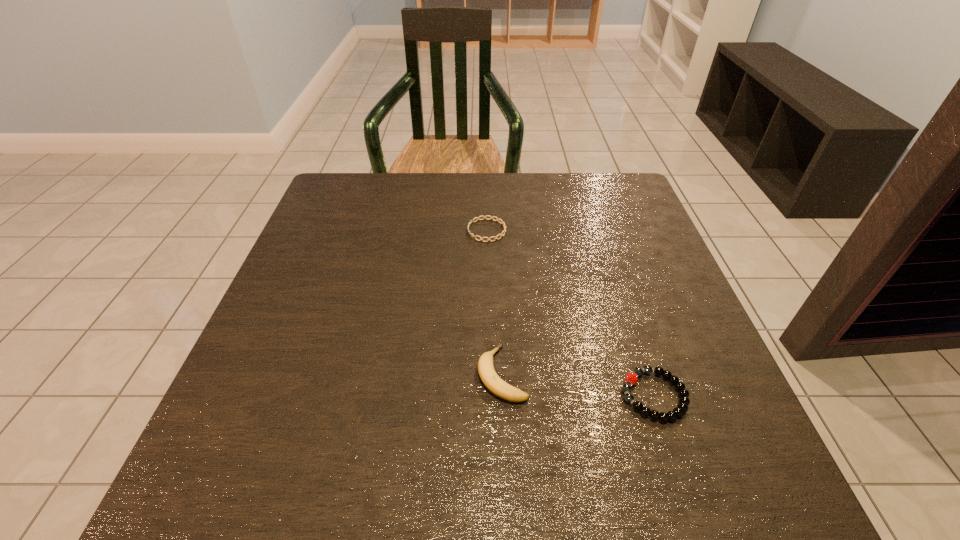
The width and height of the screenshot is (960, 540). I want to click on vacant space that is in between the rightmost object and the banana, so click(578, 384).

Identify the location of unoccupied position between the farther bracelet and the banana. (494, 302).

At what (x,y) coordinates should I click in order to perform the action: click on free space between the left bracelet and the tallest object. Please return your answer as a coordinate pair (x, y). This screenshot has width=960, height=540. Looking at the image, I should click on (494, 302).

The image size is (960, 540). I want to click on vacant region between the left bracelet and the tallest object, so click(494, 302).

Identify the location of vacant region between the banana and the farther bracelet. (494, 302).

You are a GUI agent. You are given a task and a screenshot of the screen. Output one action in this format:
    pyautogui.click(x=<x>, y=<y>)
    Task: Click on the blank region between the banana and the farther bracelet
    This screenshot has width=960, height=540.
    Given the screenshot: What is the action you would take?
    pyautogui.click(x=494, y=302)

This screenshot has height=540, width=960. What are the coordinates of `free space between the second shortest object and the shorter bracelet` in the screenshot? It's located at (570, 313).

The width and height of the screenshot is (960, 540). Identify the location of unoccupied position between the taller bracelet and the left bracelet. (570, 313).

Find the location of `object that stands as the second closest to the nearer bracelet`. object that stands as the second closest to the nearer bracelet is located at coordinates (484, 217).

Locate which object ranks second in proximity to the tallest object. Please provide its 2D coordinates. Your answer should be formatted as a tuple, i.e. [(x, y)], where the tuple contains the x and y coordinates of a point satisfying the conditions above.

[(484, 217)]